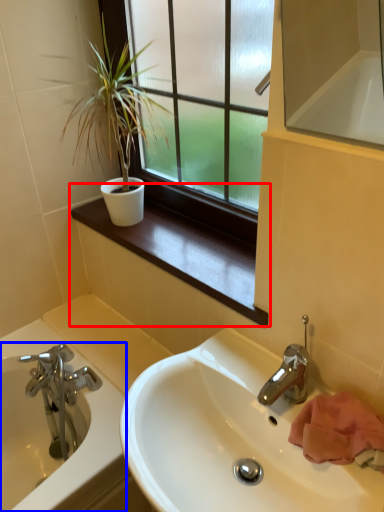
Question: Which object appears farthest to the camera in this image, window sill (highlighted by a red box) or bathtub (highlighted by a blue box)?

Choices:
 (A) window sill
 (B) bathtub

Answer: (B)